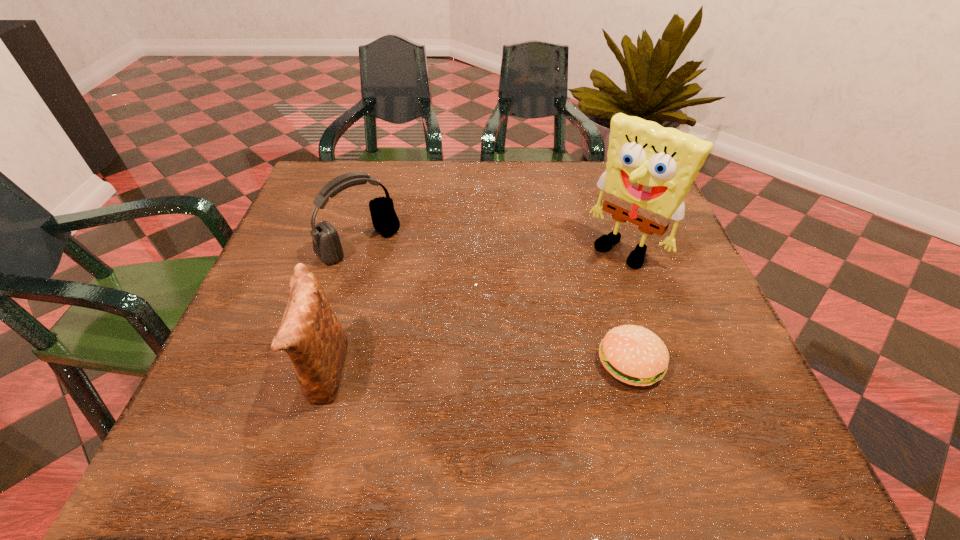
At what (x,y) coordinates should I click in order to perform the action: click on free spot on the desktop that is between the clutch bag and the patty and is positioned on the face of the tallest object. Please return your answer as a coordinate pair (x, y). This screenshot has width=960, height=540. Looking at the image, I should click on (509, 367).

Where is `free spot on the desktop that is between the clutch bag and the patty and is positioned on the headband of the headset`? free spot on the desktop that is between the clutch bag and the patty and is positioned on the headband of the headset is located at coordinates [x=486, y=368].